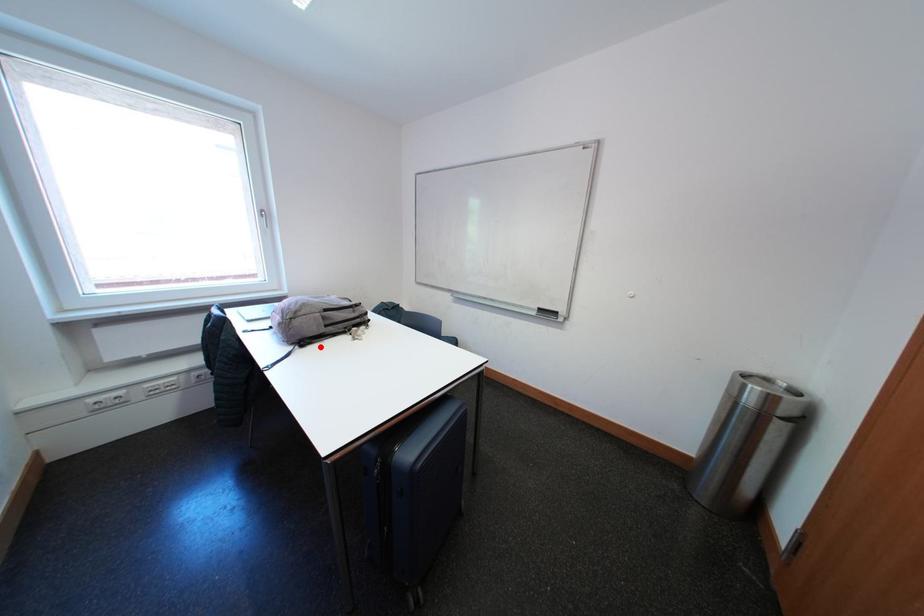
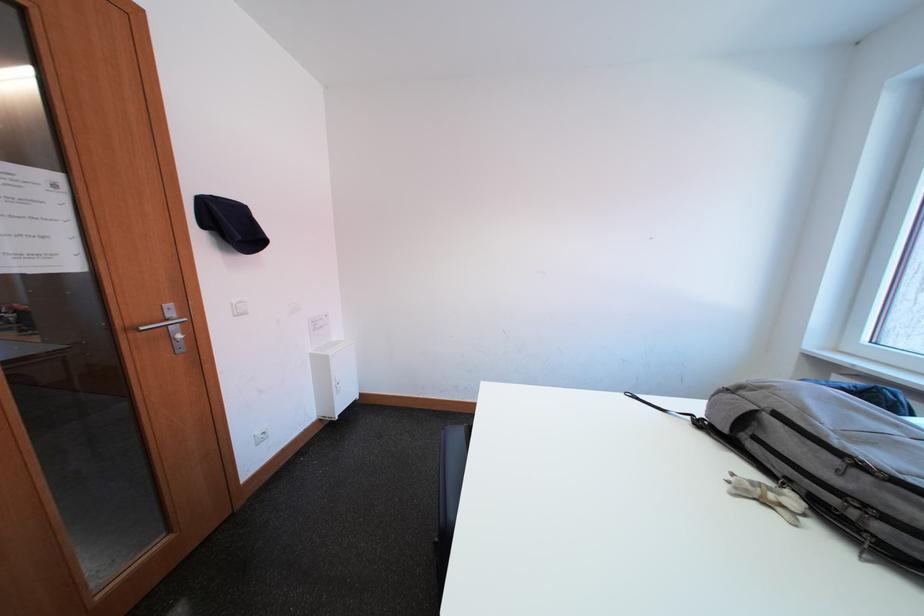
Locate, in the second image, the point that corresponds to the highlighted location in the first image.

(719, 438)